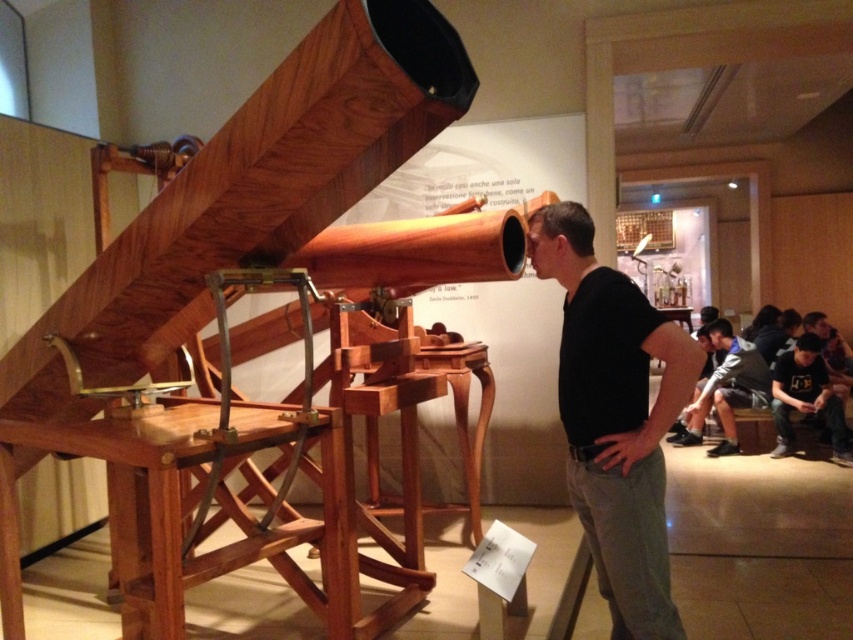
Please describe the location of the black matte shirt at center in the image using coordinates. The scene is an indoor museum with a large wooden telescope displayed. The shirt is part of a man standing near the telescope.

The black matte shirt at center is located at coordinates point (614,417).